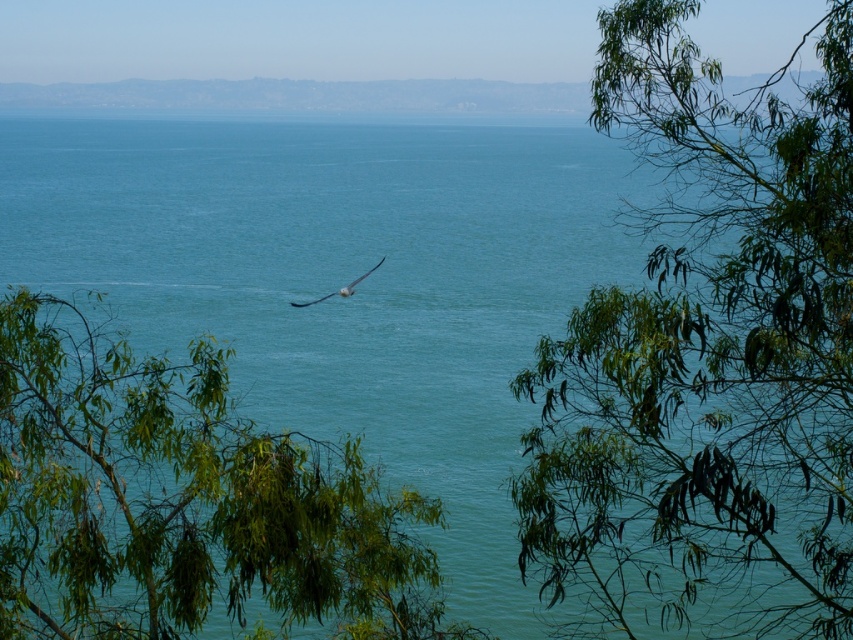
In the scene shown: You are a photographer standing in the coastal scene. You notice a green leafy tree at center and a white feathered bird at center. Which object is closer to the horizon?

The white feathered bird at center is closer to the horizon because it is positioned above the green leafy tree at center, which is placed underneath it.

You are standing on the beach and looking at the green leafy branches at upper right and the white feathered bird at center. Which object is higher up in the sky?

The green leafy branches at upper right are higher up in the sky than the white feathered bird at center.

You are standing at the center of the image and want to look towards the green leafy branches at upper right. In which direction should you turn your head?

The green leafy branches at upper right are located at coordinates point (708, 356), so you should turn your head to the right and upwards to look towards them.